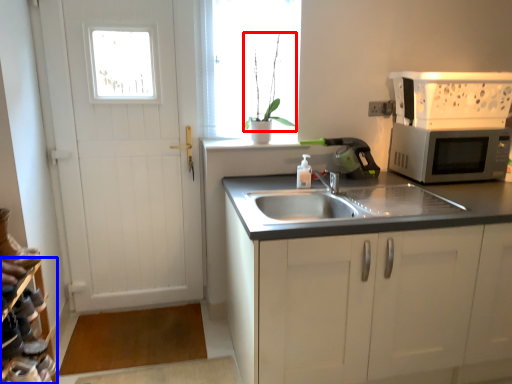
Question: Which of the following is the closest to the observer, plant (highlighted by a red box) or shelf (highlighted by a blue box)?

Choices:
 (A) plant
 (B) shelf

Answer: (B)